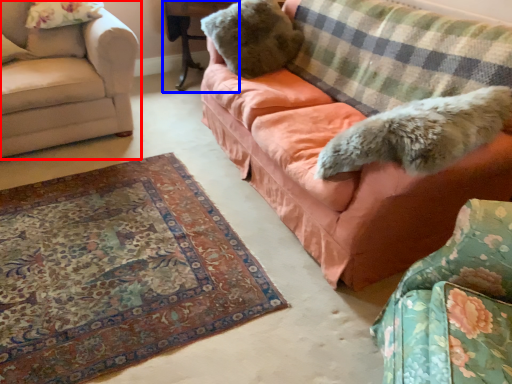
Question: Which point is closer to the camera, studio couch (highlighted by a red box) or table (highlighted by a blue box)?

Choices:
 (A) studio couch
 (B) table

Answer: (A)